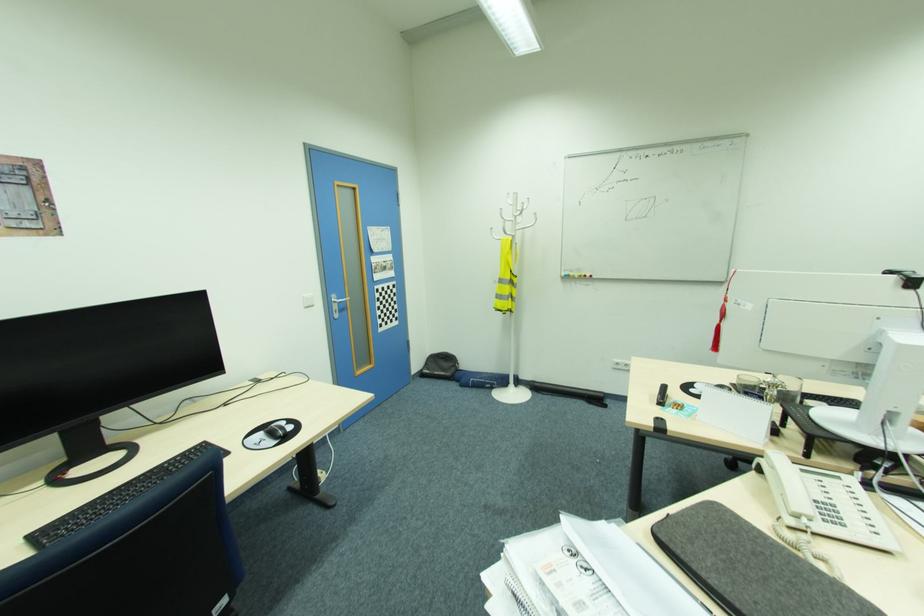
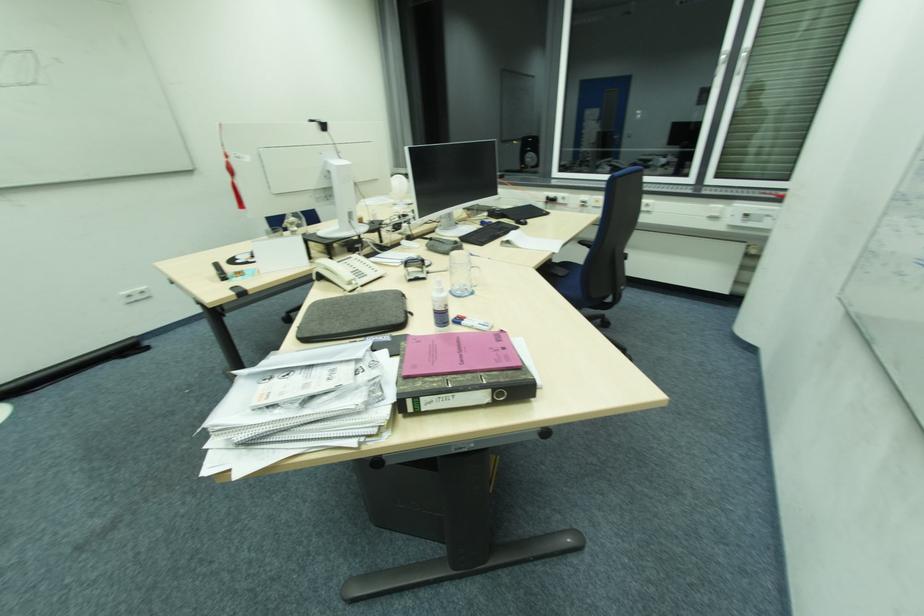
The point at (713, 582) is marked in the first image. Where is the corresponding point in the second image?

(348, 331)